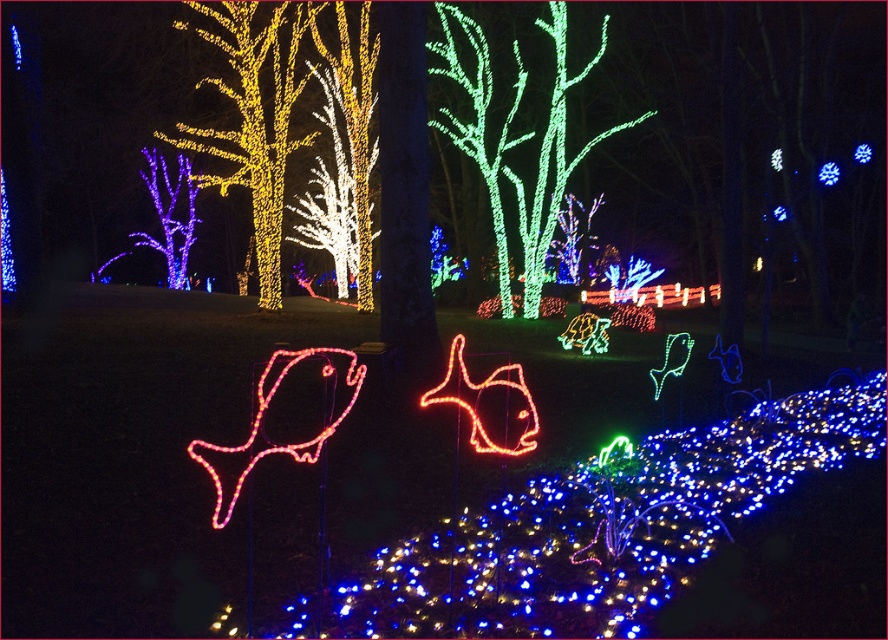
This screenshot has width=888, height=640. Describe the element at coordinates (517, 141) in the screenshot. I see `green illuminated tree at center` at that location.

Between green illuminated tree at center and purple illuminated tree at upper left, which one is positioned higher?

Positioned higher is green illuminated tree at center.

This screenshot has height=640, width=888. I want to click on green illuminated tree at center, so click(x=517, y=141).

Does purple illuminated tree at upper left have a lesser width compared to blue led lights at center?

Indeed, purple illuminated tree at upper left has a lesser width compared to blue led lights at center.

Between point (147, 186) and point (830, 164), which one is positioned behind?

Point (147, 186)

The width and height of the screenshot is (888, 640). I want to click on purple illuminated tree at upper left, so click(170, 214).

The image size is (888, 640). Find the location of `purple illuminated tree at upper left`. purple illuminated tree at upper left is located at coordinates (170, 214).

Is point (275, 74) positioned behind point (186, 198)?

No, it is in front of (186, 198).

Which is more to the right, yellow illuminated tree at upper left or purple illuminated tree at upper left?

Positioned to the right is yellow illuminated tree at upper left.

Between point (294, 32) and point (171, 262), which one is positioned in front?

Positioned in front is point (294, 32).

Where is `yellow illuminated tree at upper left`? yellow illuminated tree at upper left is located at coordinates (252, 115).